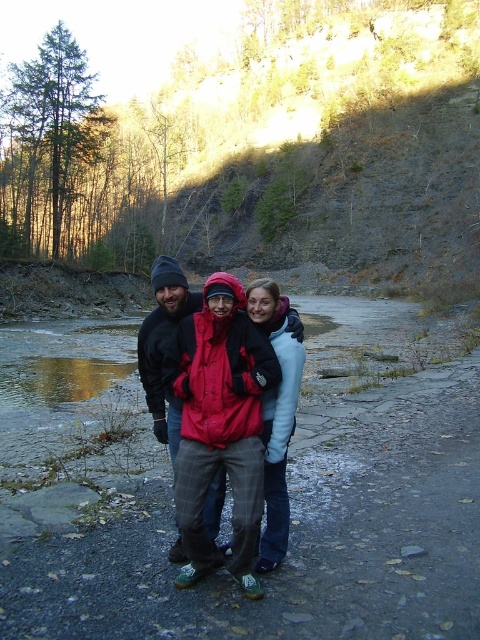
You are a photographer trying to capture a detailed shot of the matte red jacket at center and the plaid woolen pants at center. Which object should you zoom in on to ensure it fills the frame more without moving the camera?

The matte red jacket at center is smaller than the plaid woolen pants at center, so you should zoom in on the matte red jacket at center to make it fill the frame more without moving the camera.

You are a photographer trying to position a tripod in the exact center of the image. The image has three people wearing jackets of different colors. The person in the matte red jacket at center is standing at point (207, 408). Is the exact center of the image at point 0.5, 0.5? If so, is the matte red jacket at center closer to the center than the other jackets?

The exact center of the image is at point 0.5, 0.5. The matte red jacket at center is located at point (207, 408), which is 0.139 units away from the center in the x direction and 0.067 units in the y direction. Since the distance from the center is sqrt 0.139 squared plus 0.067 squared, which is approximately 0.155 units. Therefore, the matte red jacket at center is closer to the center than the other jackets unless they are positioned even closer.